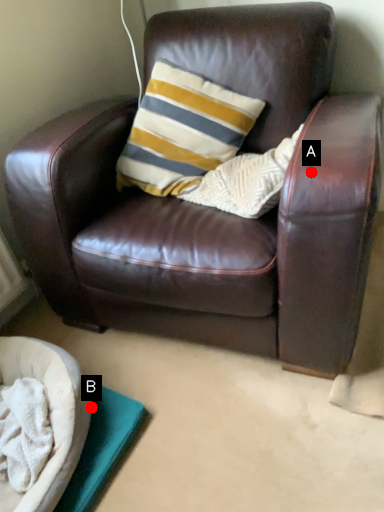
Question: Two points are circled on the image, labeled by A and B beside each circle. Which point is further to the camera?

Choices:
 (A) A is further
 (B) B is further

Answer: (B)